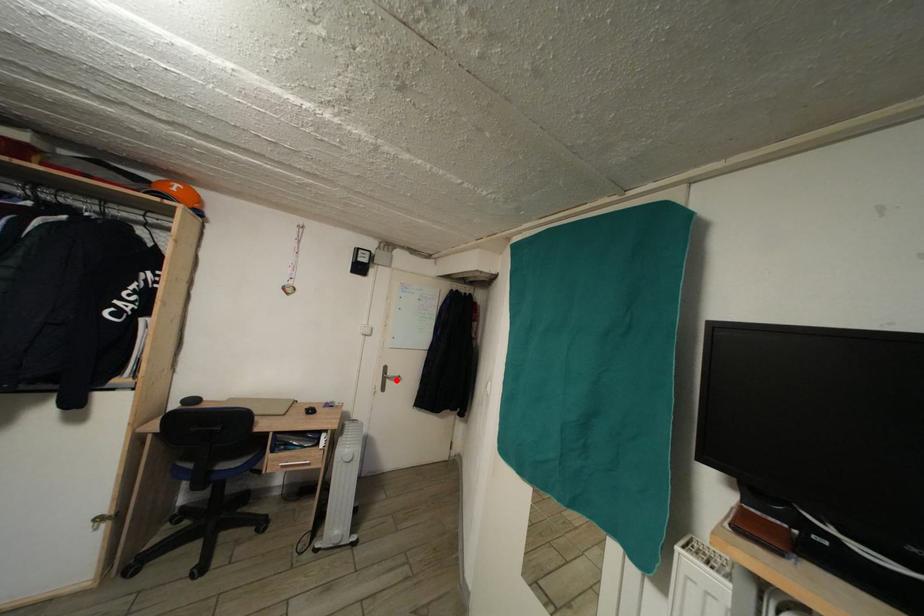
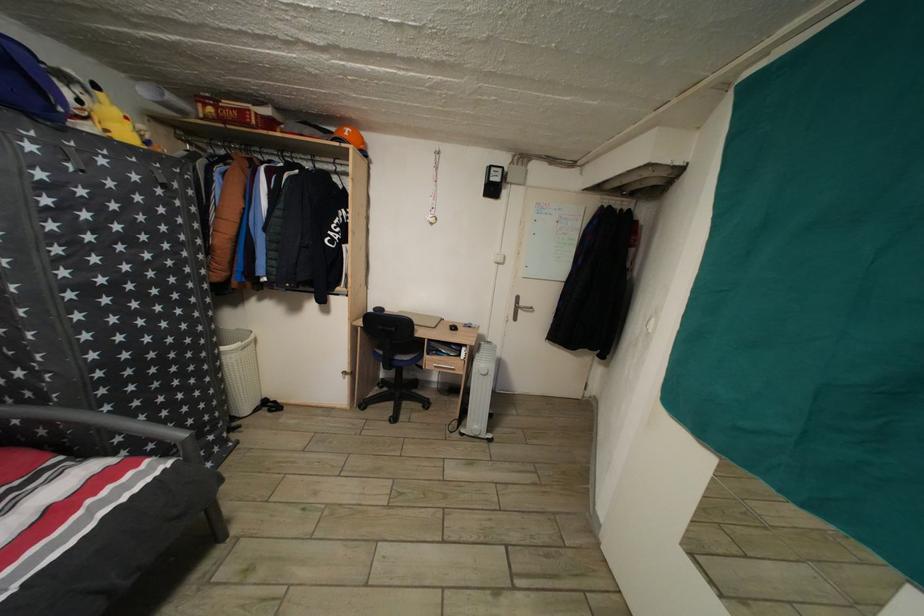
Question: I am providing you with two images of the same scene from different viewpoints. A red point is shown in image1. For the corresponding object point in image2, is it positioned nearer or farther from the camera?

Choices:
 (A) Nearer
 (B) Farther

Answer: (A)